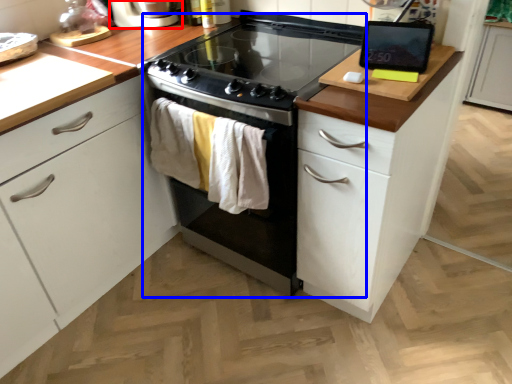
Question: Which of the following is the farthest to the observer, home appliance (highlighted by a red box) or oven (highlighted by a blue box)?

Choices:
 (A) home appliance
 (B) oven

Answer: (A)